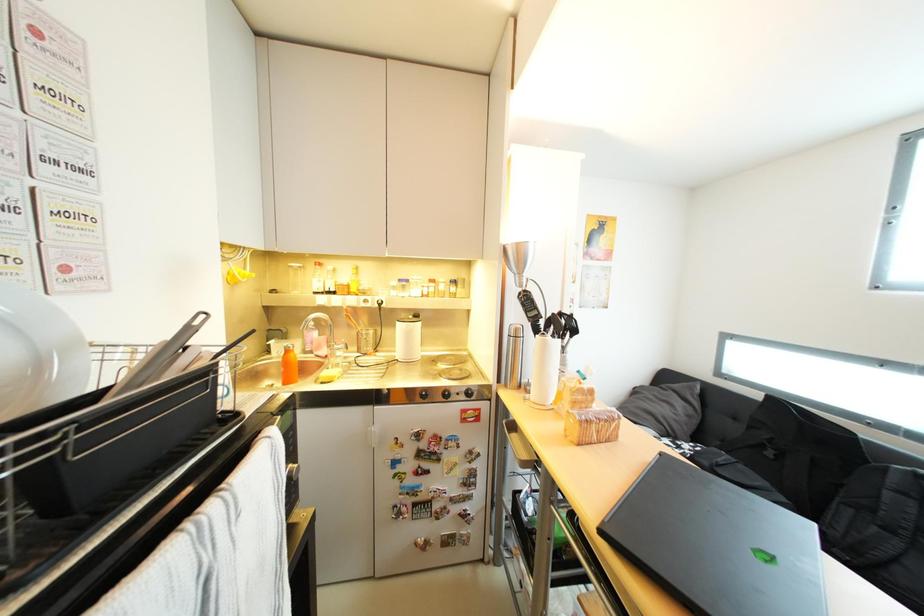
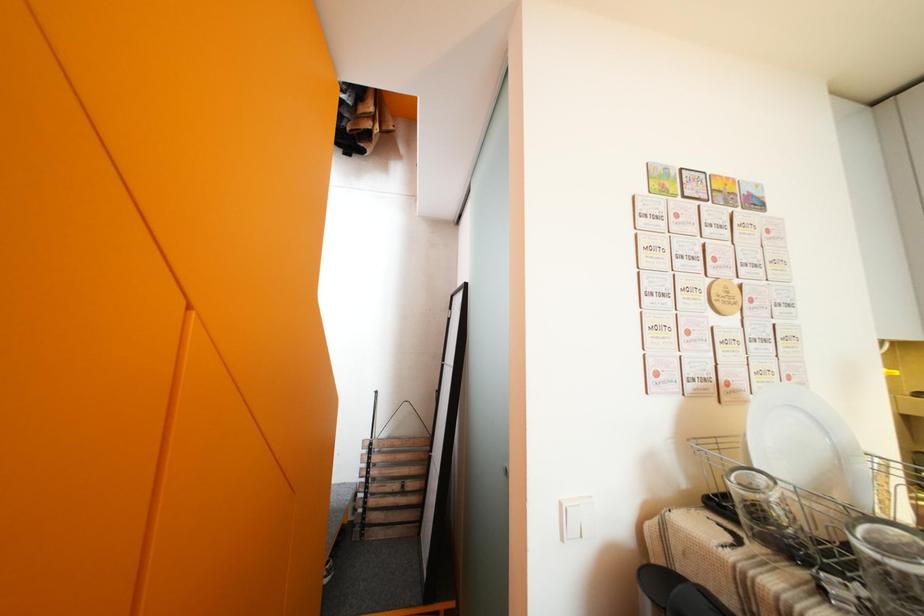
Question: The camera is either moving clockwise (left) or counter-clockwise (right) around the object. The first image is from the beginning of the video and the second image is from the end. Is the camera moving left or right when shooting the video?

Choices:
 (A) Left
 (B) Right

Answer: (B)